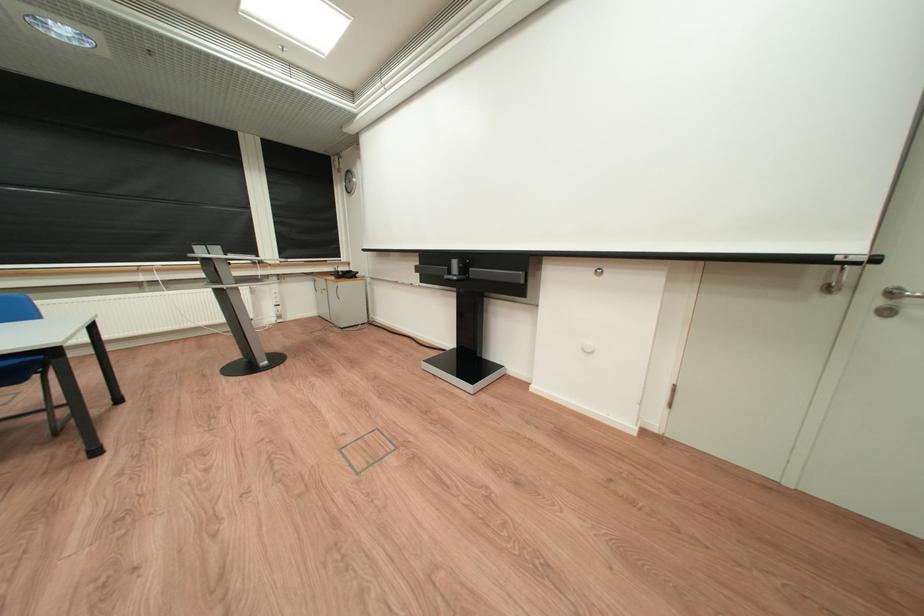
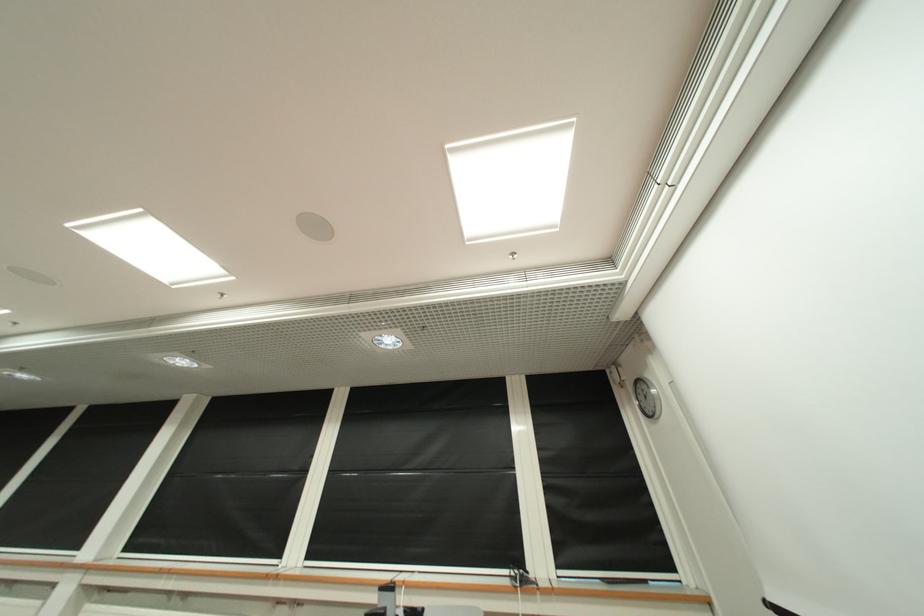
Find the pixel in the second image that matches (355,183) in the first image.

(642, 402)